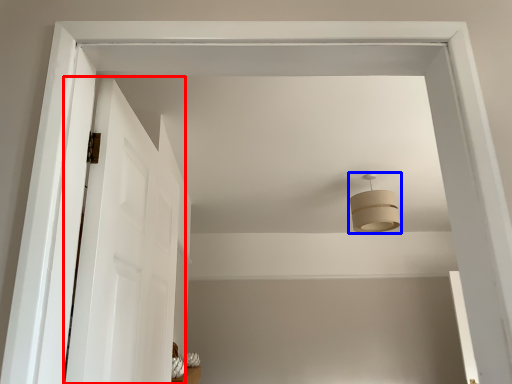
Question: Which of the following is the farthest to the observer, door (highlighted by a red box) or fixture (highlighted by a blue box)?

Choices:
 (A) door
 (B) fixture

Answer: (B)